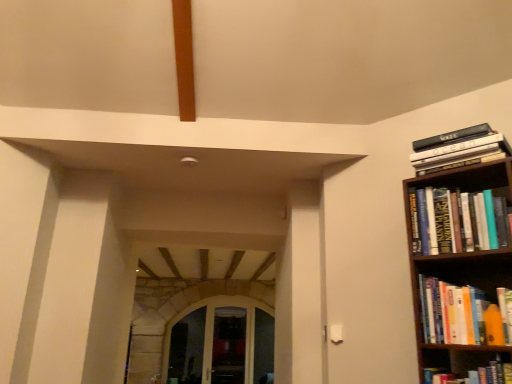
Question: Is orange matte bookshelf at right, the 2th book ordered from the bottom, surrounded by hardcover book at right, arranged as the first book when ordered from the bottom?

Choices:
 (A) yes
 (B) no

Answer: (B)

Question: Is hardcover book at right, arranged as the first book when ordered from the bottom, positioned far away from orange matte bookshelf at right, the 2th book ordered from the bottom?

Choices:
 (A) yes
 (B) no

Answer: (B)

Question: Can you confirm if hardcover book at right, arranged as the first book when ordered from the bottom, is shorter than orange matte bookshelf at right, which is the 3th book in top-to-bottom order?

Choices:
 (A) no
 (B) yes

Answer: (B)

Question: Is hardcover book at right, which is counted as the fourth book, starting from the top, to the left of orange matte bookshelf at right, which is the 3th book in top-to-bottom order, from the viewer's perspective?

Choices:
 (A) no
 (B) yes

Answer: (B)

Question: Is hardcover book at right, arranged as the first book when ordered from the bottom, positioned in front of orange matte bookshelf at right, the 2th book ordered from the bottom?

Choices:
 (A) no
 (B) yes

Answer: (B)

Question: Visually, is hardcover book at upper right, which ranks as the 3th book in bottom-to-top order, positioned to the left or to the right of hardcover book at right, which is counted as the fourth book, starting from the top?

Choices:
 (A) left
 (B) right

Answer: (B)

Question: From a real-world perspective, is hardcover book at upper right, the second book in the top-to-bottom sequence, positioned above or below hardcover book at right, which is counted as the fourth book, starting from the top?

Choices:
 (A) above
 (B) below

Answer: (A)

Question: In terms of width, does hardcover book at upper right, the second book in the top-to-bottom sequence, look wider or thinner when compared to hardcover book at right, which is counted as the fourth book, starting from the top?

Choices:
 (A) thin
 (B) wide

Answer: (A)

Question: Is hardcover book at upper right, which ranks as the 3th book in bottom-to-top order, inside the boundaries of hardcover book at right, which is counted as the fourth book, starting from the top, or outside?

Choices:
 (A) outside
 (B) inside

Answer: (A)

Question: Looking at the image, does hardcover book at upper right, the second book in the top-to-bottom sequence, seem bigger or smaller compared to transparent glass door at center, acting as the first glass door starting from the right?

Choices:
 (A) big
 (B) small

Answer: (B)

Question: In terms of height, does hardcover book at upper right, the second book in the top-to-bottom sequence, look taller or shorter compared to transparent glass door at center, acting as the first glass door starting from the right?

Choices:
 (A) short
 (B) tall

Answer: (A)

Question: Is point (418, 225) positioned closer to the camera than point (223, 352)?

Choices:
 (A) farther
 (B) closer

Answer: (B)

Question: Visually, is hardcover book at upper right, which ranks as the 3th book in bottom-to-top order, positioned to the left or to the right of transparent glass door at center, acting as the first glass door starting from the right?

Choices:
 (A) left
 (B) right

Answer: (B)

Question: In terms of size, does transparent glass door at center, which ranks as the second glass door in left-to-right order, appear bigger or smaller than hardcover book at upper right, which ranks as the 3th book in bottom-to-top order?

Choices:
 (A) big
 (B) small

Answer: (A)

Question: From their relative heights in the image, would you say transparent glass door at center, which ranks as the second glass door in left-to-right order, is taller or shorter than hardcover book at upper right, which ranks as the 3th book in bottom-to-top order?

Choices:
 (A) short
 (B) tall

Answer: (B)